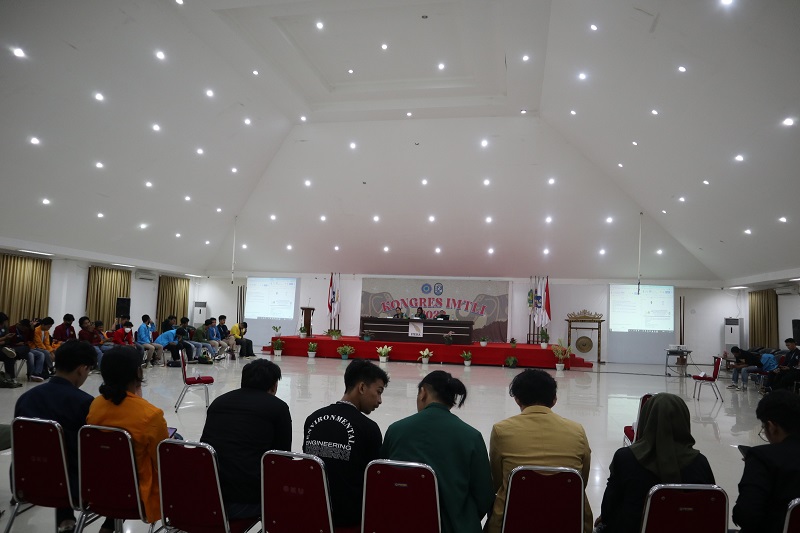
This screenshot has height=533, width=800. What are the coordinates of `curtain` in the screenshot? It's located at (114, 292), (36, 289), (172, 289).